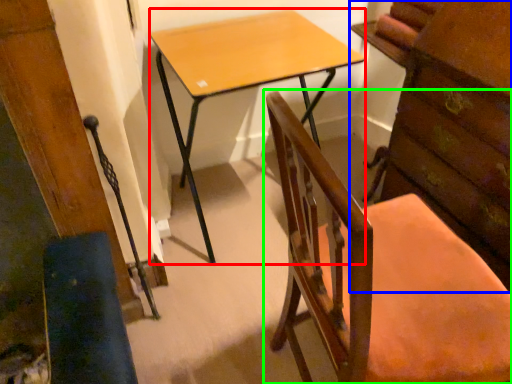
Question: Which object is the closest to the desk (highlighted by a red box)? Choose among these: chest of drawers (highlighted by a blue box) or chair (highlighted by a green box).

Choices:
 (A) chest of drawers
 (B) chair

Answer: (A)